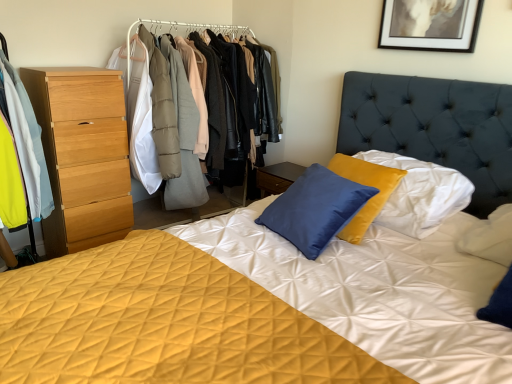
What is the approximate width of black matte picture frame at upper center?

It is 1.12 inches.

You are a GUI agent. You are given a task and a screenshot of the screen. Output one action in this format:
    pyautogui.click(x=<x>, y=<y>)
    Task: Click on the light wood chest of drawers at left
    The image size is (512, 384).
    Given the screenshot: What is the action you would take?
    pyautogui.click(x=83, y=155)

At what (x,y) coordinates should I click in order to perform the action: click on wooden dresser at left. Please return your answer as a coordinate pair (x, y). The image size is (512, 384). Looking at the image, I should click on (207, 43).

Is light blue fabric coat at left wider or thinner than black matte picture frame at upper center?

light blue fabric coat at left is wider than black matte picture frame at upper center.

Is light blue fabric coat at left facing towards black matte picture frame at upper center?

No, light blue fabric coat at left is not turned towards black matte picture frame at upper center.

Is the position of light blue fabric coat at left less distant than that of black matte picture frame at upper center?

Yes, the depth of light blue fabric coat at left is less than that of black matte picture frame at upper center.

Identify the location of clothing below the black matte picture frame at upper center (from the image's perspective). (27, 142).

Between wooden dresser at left and light blue fabric coat at left, which one has more height?

wooden dresser at left is taller.

Which object is wider, wooden dresser at left or light blue fabric coat at left?

Wider between the two is light blue fabric coat at left.

Is wooden dresser at left bigger than light blue fabric coat at left?

Correct, wooden dresser at left is larger in size than light blue fabric coat at left.

From the image's perspective, which object appears higher, wooden dresser at left or light blue fabric coat at left?

wooden dresser at left.

Considering the positions of point (1, 52) and point (66, 211), is point (1, 52) closer or farther from the camera than point (66, 211)?

Point (1, 52) appears to be closer to the viewer than point (66, 211).

In terms of width, does light blue fabric coat at left look wider or thinner when compared to light wood chest of drawers at left?

Clearly, light blue fabric coat at left has more width compared to light wood chest of drawers at left.

Is light wood chest of drawers at left surrounded by light blue fabric coat at left?

Actually, light wood chest of drawers at left is outside light blue fabric coat at left.

From the image's perspective, between light blue fabric coat at left and light wood chest of drawers at left, which one is located above?

light blue fabric coat at left.

Is wooden dresser at left directly adjacent to black matte picture frame at upper center?

No, wooden dresser at left is not beside black matte picture frame at upper center.

Where is `picture frame on the right of wooden dresser at left`? The width and height of the screenshot is (512, 384). picture frame on the right of wooden dresser at left is located at coordinates (430, 24).

Is wooden dresser at left taller or shorter than black matte picture frame at upper center?

wooden dresser at left is taller than black matte picture frame at upper center.

Between wooden dresser at left and black matte picture frame at upper center, which one is positioned in front?

black matte picture frame at upper center is in front.

The height and width of the screenshot is (384, 512). What are the coordinates of `chest of drawers below the black matte picture frame at upper center (from a real-world perspective)` in the screenshot? It's located at (83, 155).

Based on the photo, how many degrees apart are the facing directions of black matte picture frame at upper center and light wood chest of drawers at left?

There is a 92.7-degree angle between the facing directions of black matte picture frame at upper center and light wood chest of drawers at left.

Which object is thinner, black matte picture frame at upper center or light wood chest of drawers at left?

black matte picture frame at upper center is thinner.

Is black matte picture frame at upper center surrounding wooden dresser at left?

No, black matte picture frame at upper center does not contain wooden dresser at left.

Is black matte picture frame at upper center next to wooden dresser at left?

No, black matte picture frame at upper center is not beside wooden dresser at left.

Does point (440, 8) lie behind point (201, 141)?

No, it is in front of (201, 141).

From the image's perspective, which object appears higher, black matte picture frame at upper center or wooden dresser at left?

black matte picture frame at upper center, from the image's perspective.

Considering the points (116, 185) and (174, 21), which point is in front, point (116, 185) or point (174, 21)?

The point (116, 185) is in front.

From a real-world perspective, does light wood chest of drawers at left sit lower than wooden dresser at left?

Yes.

Consider the image. From the image's perspective, is light wood chest of drawers at left above wooden dresser at left?

No, from the image's perspective, light wood chest of drawers at left is not above wooden dresser at left.

Does light wood chest of drawers at left contain wooden dresser at left?

Actually, wooden dresser at left is outside light wood chest of drawers at left.

This screenshot has width=512, height=384. Identify the location of clothing below the black matte picture frame at upper center (from a real-world perspective). (27, 142).

Locate an element on the screen. The image size is (512, 384). clothing on the left of the wooden dresser at left is located at coordinates (27, 142).

When comparing their distances from black matte picture frame at upper center, does light blue fabric coat at left or wooden dresser at left seem closer?

wooden dresser at left is positioned closer to the anchor black matte picture frame at upper center.

From the image, which object appears to be nearer to wooden dresser at left, light wood chest of drawers at left or black matte picture frame at upper center?

light wood chest of drawers at left is closer to wooden dresser at left.

Looking at this image, when comparing their distances from light blue fabric coat at left, does black matte picture frame at upper center or light wood chest of drawers at left seem closer?

light wood chest of drawers at left is closer to light blue fabric coat at left.

Which object lies further to the anchor point black matte picture frame at upper center, wooden dresser at left or light wood chest of drawers at left?

light wood chest of drawers at left lies further to black matte picture frame at upper center than the other object.

When comparing their distances from light blue fabric coat at left, does light wood chest of drawers at left or wooden dresser at left seem closer?

light wood chest of drawers at left is positioned closer to the anchor light blue fabric coat at left.

Based on their spatial positions, is black matte picture frame at upper center or light wood chest of drawers at left closer to wooden dresser at left?

light wood chest of drawers at left lies closer to wooden dresser at left than the other object.

Estimate the real-world distances between objects in this image. Which object is closer to light blue fabric coat at left, black matte picture frame at upper center or wooden dresser at left?

wooden dresser at left is closer to light blue fabric coat at left.

Which object lies further to the anchor point light wood chest of drawers at left, wooden dresser at left or light blue fabric coat at left?

wooden dresser at left.

Identify the location of chest of drawers between light blue fabric coat at left and wooden dresser at left. The height and width of the screenshot is (384, 512). (83, 155).

Identify the location of dresser between light blue fabric coat at left and black matte picture frame at upper center from left to right. (207, 43).

Where is `chest of drawers between light blue fabric coat at left and black matte picture frame at upper center`? chest of drawers between light blue fabric coat at left and black matte picture frame at upper center is located at coordinates (83, 155).

You are a GUI agent. You are given a task and a screenshot of the screen. Output one action in this format:
    pyautogui.click(x=<x>, y=<y>)
    Task: Click on the dresser situated between light wood chest of drawers at left and black matte picture frame at upper center from left to right
    The height and width of the screenshot is (384, 512).
    Given the screenshot: What is the action you would take?
    pyautogui.click(x=207, y=43)